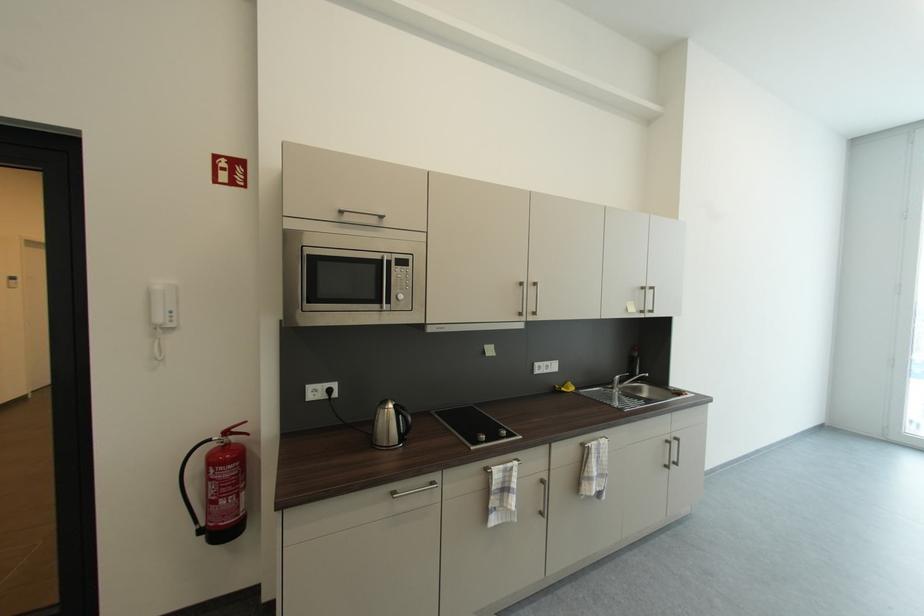
Where would you squeez the fire extinguisher handle? Please return your answer as a coordinate pair (x, y).

(189, 487)